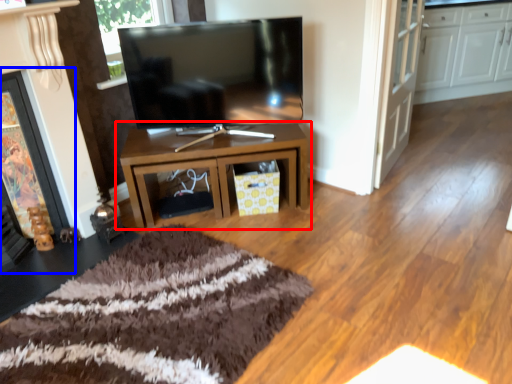
Question: Which object is further to the camera taking this photo, table (highlighted by a red box) or fireplace (highlighted by a blue box)?

Choices:
 (A) table
 (B) fireplace

Answer: (A)